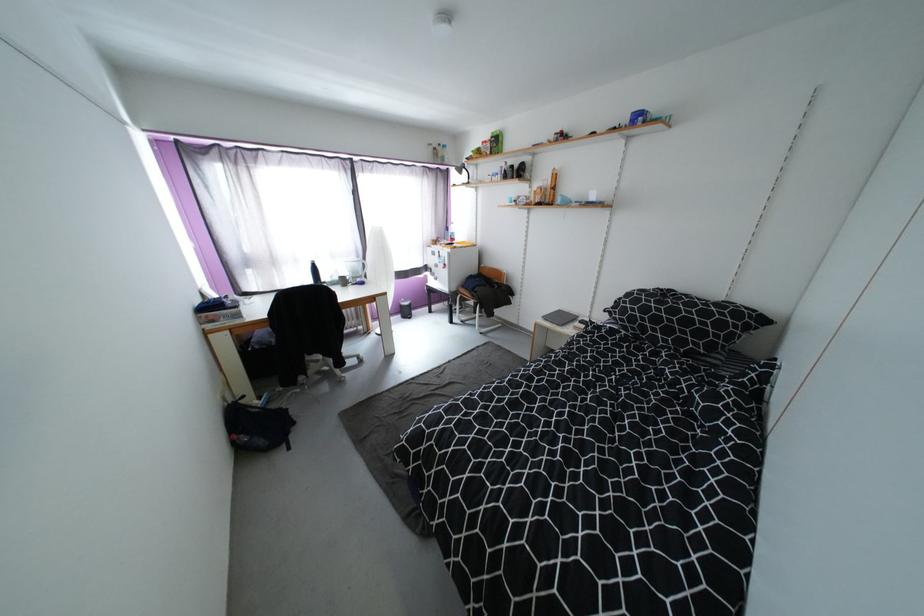
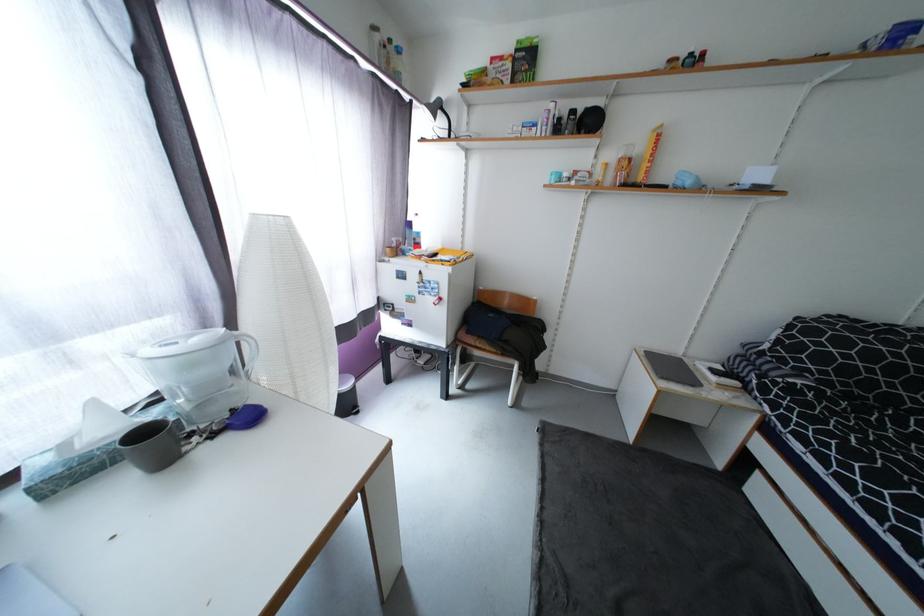
In the second image, find the point that corresponds to point 494,147 in the first image.

(515, 66)